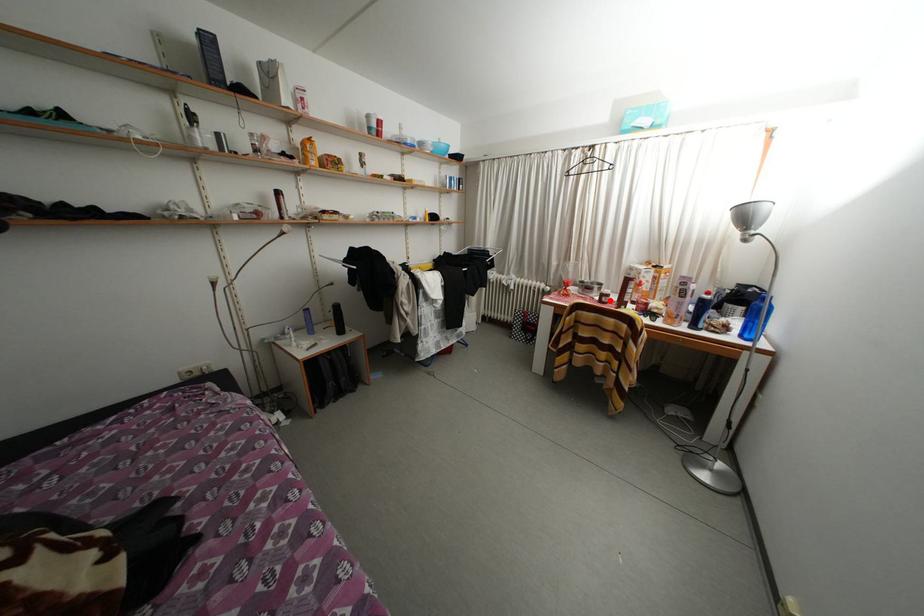
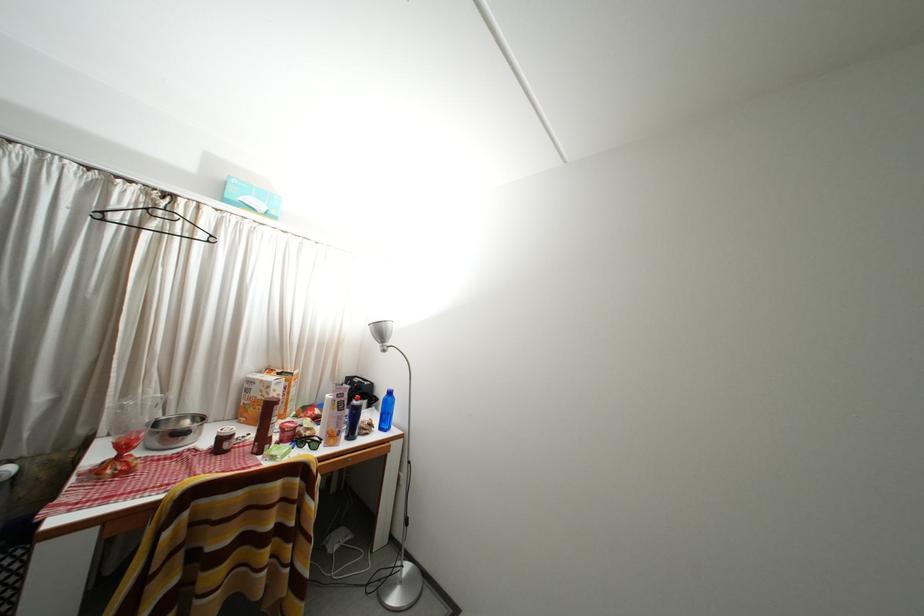
The point at the highlighted location is marked in the first image. Where is the corresponding point in the second image?

(229, 445)